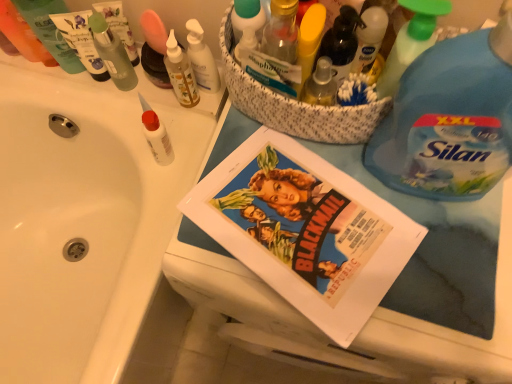
I want to click on free space to the left of matte green tube at upper left, which is the third toiletry in left-to-right order, so click(x=36, y=81).